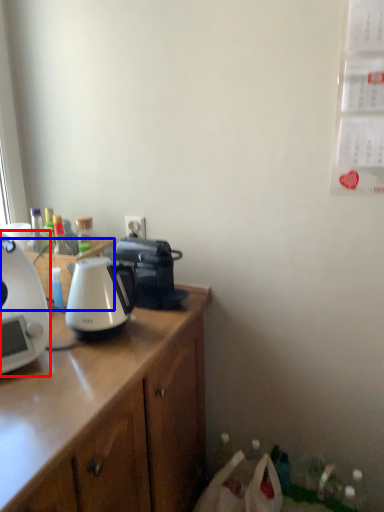
Question: Among these objects, which one is farthest to the camera, coffee maker (highlighted by a red box) or desk (highlighted by a blue box)?

Choices:
 (A) coffee maker
 (B) desk

Answer: (B)